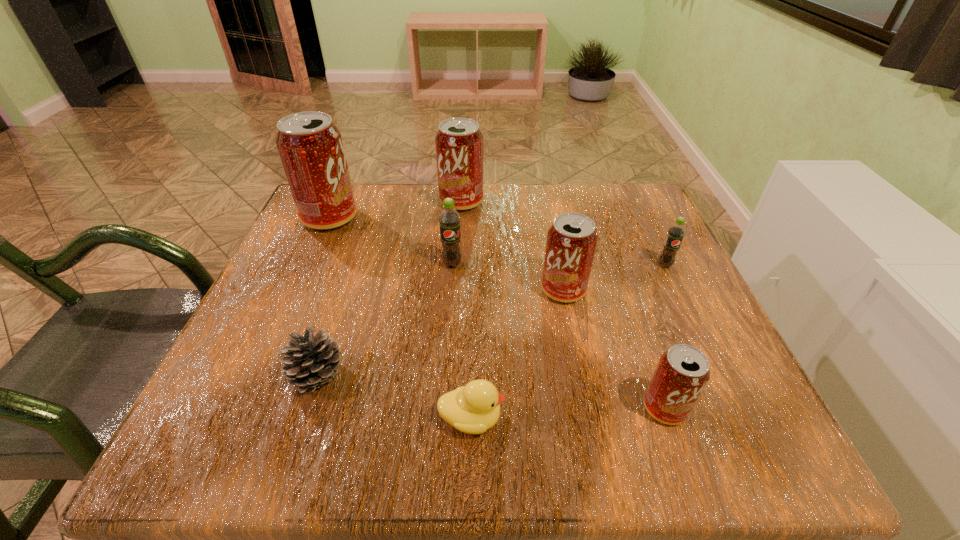
The width and height of the screenshot is (960, 540). Identify the location of vacant space that satisfies the following two spatial constraints: 1. on the front label of the third red soda can from left to right; 2. on the right side of the left green soda. (450, 290).